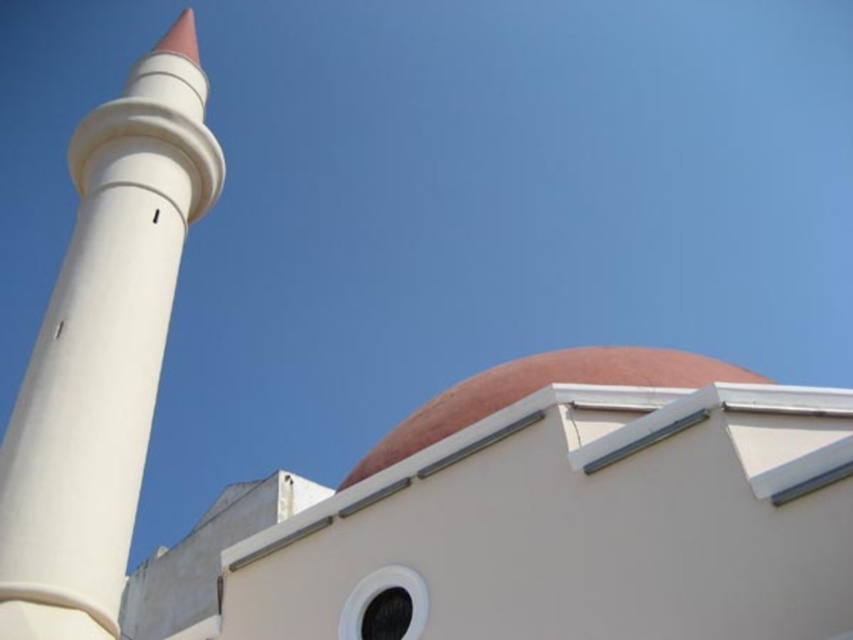
Question: Does white smooth minaret at left appear under matte pink dome at center?

Choices:
 (A) no
 (B) yes

Answer: (A)

Question: Is white smooth minaret at left above matte pink dome at center?

Choices:
 (A) yes
 (B) no

Answer: (A)

Question: Is white smooth minaret at left positioned behind matte pink dome at center?

Choices:
 (A) yes
 (B) no

Answer: (B)

Question: Which object is farther from the camera taking this photo?

Choices:
 (A) white smooth minaret at left
 (B) matte pink dome at center

Answer: (B)